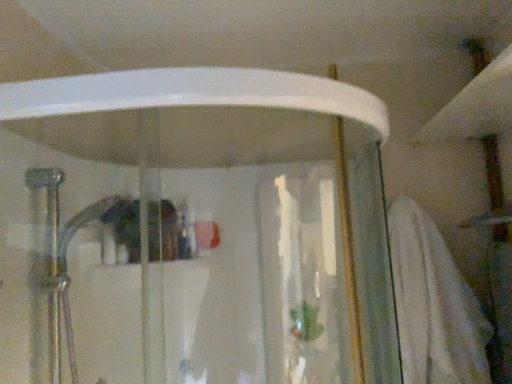
The width and height of the screenshot is (512, 384). What do you see at coordinates (194, 230) in the screenshot?
I see `transparent glass shower door at center` at bounding box center [194, 230].

You are a GUI agent. You are given a task and a screenshot of the screen. Output one action in this format:
    pyautogui.click(x=<x>, y=<y>)
    Task: Click on the transparent glass shower door at center
    
    Given the screenshot: What is the action you would take?
    pyautogui.click(x=194, y=230)

Find the location of `white soft towel at right`. white soft towel at right is located at coordinates (434, 304).

The image size is (512, 384). Describe the element at coordinates (434, 304) in the screenshot. I see `white soft towel at right` at that location.

In the scene shown: What is the approximate height of white soft towel at right?

white soft towel at right is 67.19 centimeters in height.

The height and width of the screenshot is (384, 512). In order to click on transparent glass shower door at center in this screenshot , I will do `click(194, 230)`.

Looking at this image, does white soft towel at right appear on the left side of transparent glass shower door at center?

In fact, white soft towel at right is to the right of transparent glass shower door at center.

Considering their positions, is white soft towel at right located in front of or behind transparent glass shower door at center?

Clearly, white soft towel at right is behind transparent glass shower door at center.

Does point (486, 328) come closer to viewer compared to point (226, 206)?

That is False.

From the image's perspective, who appears lower, white soft towel at right or transparent glass shower door at center?

white soft towel at right, from the image's perspective.

From a real-world perspective, is white soft towel at right physically located above or below transparent glass shower door at center?

white soft towel at right is situated lower than transparent glass shower door at center in the real world.

Between white soft towel at right and transparent glass shower door at center, which one has smaller width?

white soft towel at right.

Is white soft towel at right taller than transparent glass shower door at center?

Incorrect, the height of white soft towel at right is not larger of that of transparent glass shower door at center.

Looking at the image, does white soft towel at right seem bigger or smaller compared to transparent glass shower door at center?

white soft towel at right is smaller than transparent glass shower door at center.

Choose the correct answer: Is white soft towel at right inside transparent glass shower door at center or outside it?

white soft towel at right is outside transparent glass shower door at center.

Are white soft towel at right and transparent glass shower door at center far apart?

No, white soft towel at right is not far from transparent glass shower door at center.

Is white soft towel at right oriented towards transparent glass shower door at center?

No, white soft towel at right is not turned towards transparent glass shower door at center.

The image size is (512, 384). I want to click on bath towel below the transparent glass shower door at center (from the image's perspective), so click(x=434, y=304).

Can you confirm if transparent glass shower door at center is positioned to the right of white soft towel at right?

In fact, transparent glass shower door at center is to the left of white soft towel at right.

Considering the relative positions of transparent glass shower door at center and white soft towel at right in the image provided, is transparent glass shower door at center behind white soft towel at right?

Result: No, transparent glass shower door at center is in front of white soft towel at right.

Between point (368, 197) and point (392, 218), which one is positioned behind?

The point (368, 197) is more distant.

From the image's perspective, is transparent glass shower door at center under white soft towel at right?

No, from the image's perspective, transparent glass shower door at center is not beneath white soft towel at right.

From a real-world perspective, who is located lower, transparent glass shower door at center or white soft towel at right?

In real-world perspective, white soft towel at right is lower.

Considering the relative sizes of transparent glass shower door at center and white soft towel at right in the image provided, is transparent glass shower door at center thinner than white soft towel at right?

In fact, transparent glass shower door at center might be wider than white soft towel at right.

Which of these two, transparent glass shower door at center or white soft towel at right, stands shorter?

With less height is white soft towel at right.

Considering the relative sizes of transparent glass shower door at center and white soft towel at right in the image provided, is transparent glass shower door at center bigger than white soft towel at right?

Indeed, transparent glass shower door at center has a larger size compared to white soft towel at right.

Is transparent glass shower door at center not inside white soft towel at right?

Yes, transparent glass shower door at center is not within white soft towel at right.

Is transparent glass shower door at center not near white soft towel at right?

Actually, transparent glass shower door at center and white soft towel at right are a little close together.

Is transparent glass shower door at center looking in the opposite direction of white soft towel at right?

No, white soft towel at right is not at the back of transparent glass shower door at center.

How different are the orientations of transparent glass shower door at center and white soft towel at right in degrees?

The facing directions of transparent glass shower door at center and white soft towel at right are 1.45 degrees apart.

Where is `shower door above the white soft towel at right (from the image's perspective)`? shower door above the white soft towel at right (from the image's perspective) is located at coordinates (194, 230).

Identify the location of shower door above the white soft towel at right (from a real-world perspective). (194, 230).

This screenshot has height=384, width=512. Identify the location of bath towel beneath the transparent glass shower door at center (from a real-world perspective). (434, 304).